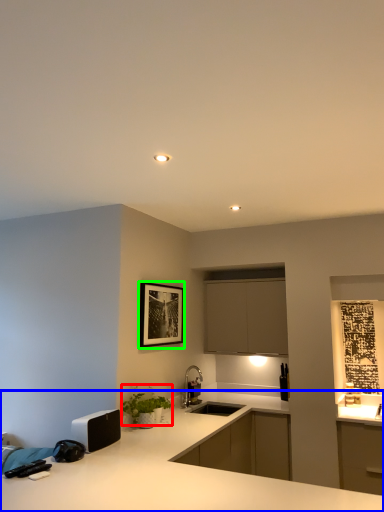
Question: Estimate the real-world distances between objects in this image. Which object is closer to plant (highlighted by a red box), countertop (highlighted by a blue box) or picture frame (highlighted by a green box)?

Choices:
 (A) countertop
 (B) picture frame

Answer: (B)